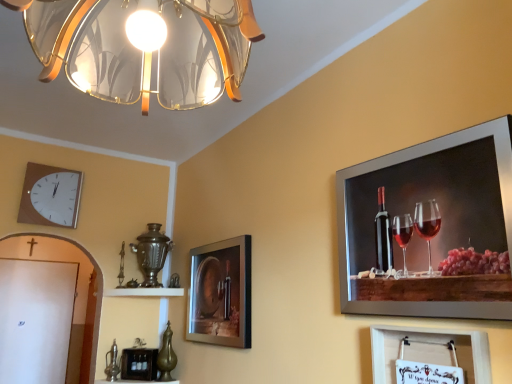
Question: Is point (143, 289) positioned closer to the camera than point (387, 297)?

Choices:
 (A) farther
 (B) closer

Answer: (A)

Question: Is white glossy shelf at center taller or shorter than metallic silver picture frame at upper right, marked as the first picture frame in a front-to-back arrangement?

Choices:
 (A) short
 (B) tall

Answer: (A)

Question: Estimate the real-world distances between objects in this image. Which object is farther from the metallic silver picture frame at upper right, marked as the first picture frame in a front-to-back arrangement?

Choices:
 (A) translucent glass lampshade at upper center
 (B) white wooden clock at upper left
 (C) wooden picture frame at lower center, marked as the 1th picture frame in a left-to-right arrangement
 (D) matte glass picture frame at center, which is the third picture frame in front-to-back order
 (E) white paper at lower right, the 1th picture frame positioned from the right

Answer: (B)

Question: Which object is the farthest from the white paper at lower right, which is counted as the 4th picture frame, starting from the left?

Choices:
 (A) translucent glass lampshade at upper center
 (B) wooden picture frame at lower center, the 4th picture frame in the right-to-left sequence
 (C) matte glass picture frame at center, arranged as the second picture frame when viewed from the left
 (D) metallic silver picture frame at upper right, marked as the first picture frame in a front-to-back arrangement
 (E) white glossy shelf at center

Answer: (E)